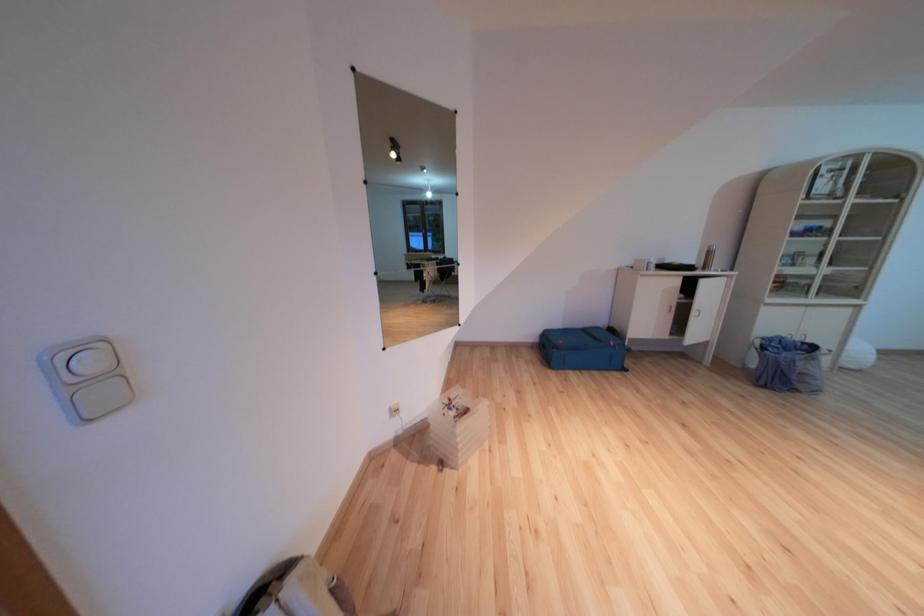
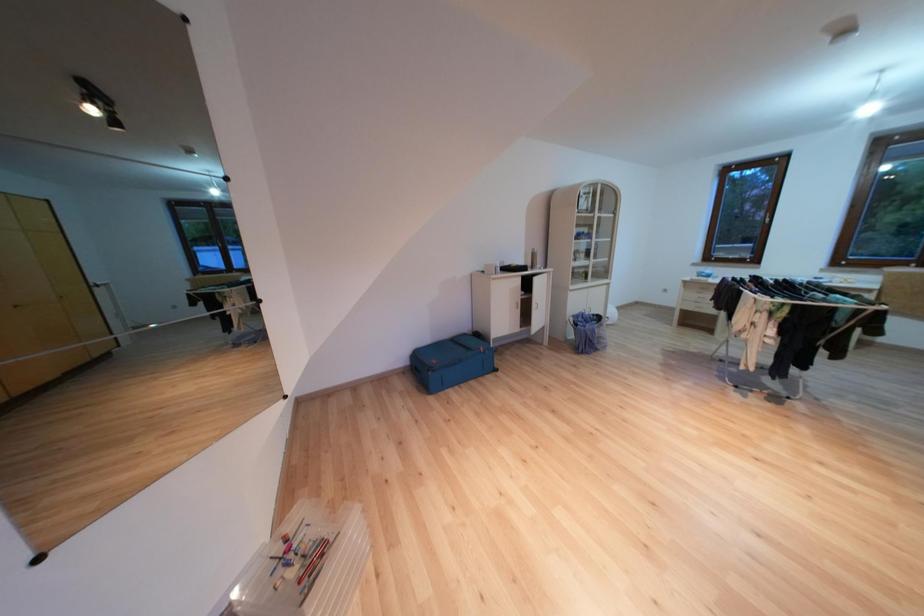
Question: The first image is from the beginning of the video and the second image is from the end. How did the camera likely rotate when shooting the video?

Choices:
 (A) Left
 (B) Right
 (C) Up
 (D) Down

Answer: (B)